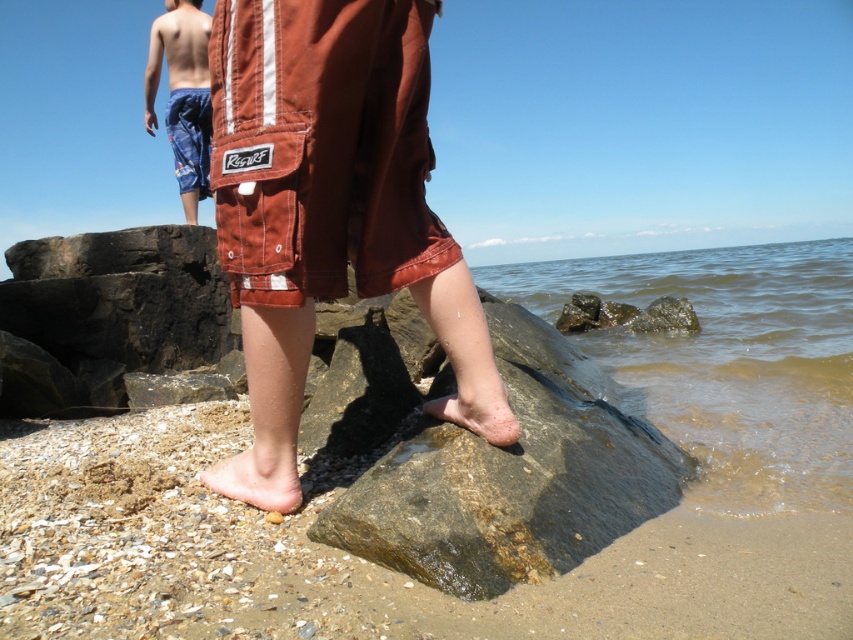
Question: Does brown cotton shorts at center have a smaller size compared to pale skin barefoot at lower center?

Choices:
 (A) yes
 (B) no

Answer: (B)

Question: Is pale skin barefoot at lower center further to camera compared to dry skin foot at lower center?

Choices:
 (A) yes
 (B) no

Answer: (A)

Question: Which point is closer to the camera?

Choices:
 (A) (577, 420)
 (B) (186, 38)

Answer: (A)

Question: Which object appears closest to the camera in this image?

Choices:
 (A) smooth skin torso at upper left
 (B) pale skin barefoot at lower center
 (C) blue printed fabric shorts at upper left

Answer: (B)

Question: Which point is farther to the camera?

Choices:
 (A) (599, 266)
 (B) (287, 484)
 (C) (466, 385)

Answer: (A)

Question: Considering the relative positions of blue printed shorts at upper left and smooth skin torso at upper left in the image provided, where is blue printed shorts at upper left located with respect to smooth skin torso at upper left?

Choices:
 (A) above
 (B) below

Answer: (A)